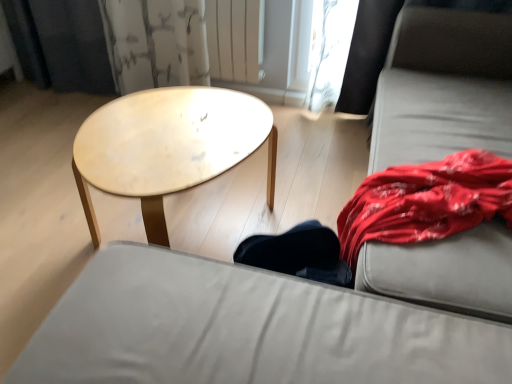
Question: Can you confirm if matte gray studio couch at center is bigger than gray fabric couch at right?

Choices:
 (A) yes
 (B) no

Answer: (B)

Question: From the image's perspective, is matte gray studio couch at center below gray fabric couch at right?

Choices:
 (A) no
 (B) yes

Answer: (B)

Question: Is the depth of matte gray studio couch at center greater than that of gray fabric couch at right?

Choices:
 (A) no
 (B) yes

Answer: (A)

Question: Does matte gray studio couch at center have a smaller size compared to gray fabric couch at right?

Choices:
 (A) no
 (B) yes

Answer: (B)

Question: Is matte gray studio couch at center located outside gray fabric couch at right?

Choices:
 (A) yes
 (B) no

Answer: (A)

Question: Is matte gray studio couch at center looking in the opposite direction of gray fabric couch at right?

Choices:
 (A) yes
 (B) no

Answer: (B)

Question: From a real-world perspective, is white painted metal radiator at upper center beneath light wood/texture coffee table at center?

Choices:
 (A) yes
 (B) no

Answer: (B)

Question: Does white painted metal radiator at upper center have a smaller size compared to light wood/texture coffee table at center?

Choices:
 (A) yes
 (B) no

Answer: (A)

Question: Does white painted metal radiator at upper center turn towards light wood/texture coffee table at center?

Choices:
 (A) yes
 (B) no

Answer: (A)

Question: Considering the relative sizes of white painted metal radiator at upper center and light wood/texture coffee table at center in the image provided, is white painted metal radiator at upper center bigger than light wood/texture coffee table at center?

Choices:
 (A) yes
 (B) no

Answer: (B)

Question: Is white painted metal radiator at upper center facing away from light wood/texture coffee table at center?

Choices:
 (A) no
 (B) yes

Answer: (A)

Question: Is the surface of white painted metal radiator at upper center in direct contact with light wood/texture coffee table at center?

Choices:
 (A) no
 (B) yes

Answer: (A)

Question: Does gray fabric couch at right have a greater height compared to white painted metal radiator at upper center?

Choices:
 (A) no
 (B) yes

Answer: (B)